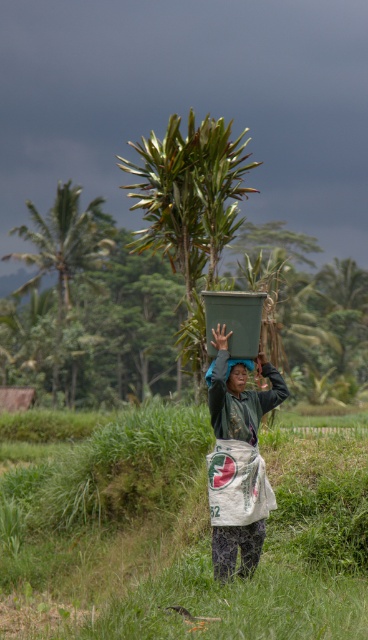
You are a delivery person who needs to carry the green matte box at center and the green leafy palm tree at left through a narrow doorway. Which object will be harder to fit through the doorway?

The green leafy palm tree at left will be harder to fit through the doorway because it has a greater width than the green matte box at center.